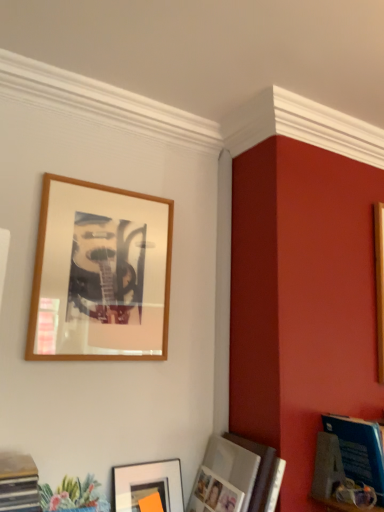
Question: Looking at their shapes, would you say matte black picture frame at lower center, which is counted as the third picture frame, starting from the top, is wider or thinner than blue glossy magazine at lower right?

Choices:
 (A) thin
 (B) wide

Answer: (A)

Question: Considering their positions, is matte black picture frame at lower center, which appears as the 1th picture frame when ordered from the bottom, located in front of or behind blue glossy magazine at lower right?

Choices:
 (A) front
 (B) behind

Answer: (B)

Question: Estimate the real-world distances between objects in this image. Which object is farther from the matte black picture frame at lower center, which appears as the 1th picture frame when ordered from the bottom?

Choices:
 (A) blue glossy magazine at lower right
 (B) wooden frame at upper left, positioned as the first picture frame in top-to-bottom order
 (C) matte silver photo frame at lower right, the 2th picture frame when ordered from top to bottom

Answer: (A)

Question: Which object is positioned closest to the wooden frame at upper left, arranged as the 3th picture frame when ordered from the bottom?

Choices:
 (A) matte black picture frame at lower center, which is counted as the third picture frame, starting from the top
 (B) blue glossy magazine at lower right
 (C) matte silver photo frame at lower right, which ranks as the 2th picture frame in bottom-to-top order

Answer: (A)